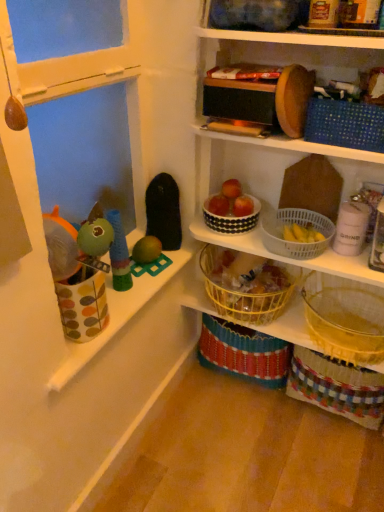
Question: In the image, is blue dotted fabric basket at upper right, which is the 5th basket in bottom-to-top order, on the left side or the right side of yellow woven basket at lower right, arranged as the first basket when ordered from the bottom?

Choices:
 (A) right
 (B) left

Answer: (B)

Question: Considering the positions of blue dotted fabric basket at upper right, the 1th basket positioned from the top, and yellow woven basket at lower right, arranged as the first basket when ordered from the bottom, in the image, is blue dotted fabric basket at upper right, the 1th basket positioned from the top, taller or shorter than yellow woven basket at lower right, arranged as the first basket when ordered from the bottom,?

Choices:
 (A) tall
 (B) short

Answer: (B)

Question: Considering the real-world distances, which object is farthest from the yellow woven basket at center?

Choices:
 (A) yellow woven basket at lower right, arranged as the first basket when ordered from the bottom
 (B) red matte apple at center, which appears as the third apple when viewed from the left
 (C) polka dot fabric cup at left, the 6th toy viewed from the right
 (D) wooden toy at upper right, which is the 4th toy in left-to-right order
 (E) green rubber toy at center, which is the 3th toy in left-to-right order

Answer: (C)

Question: Estimate the real-world distances between objects in this image. Which object is closer to the yellow wire basket at center, which is counted as the second basket, starting from the bottom?

Choices:
 (A) wooden toy at upper right, the third toy when ordered from right to left
 (B) green rubber toy at left, marked as the 5th toy in a right-to-left arrangement
 (C) green rubber toy at center, which is the 3th toy in left-to-right order
 (D) blue dotted fabric basket at upper right, which is the 5th basket in bottom-to-top order
 (E) white dotted bowl at center, arranged as the fourth basket when ordered from the bottom

Answer: (E)